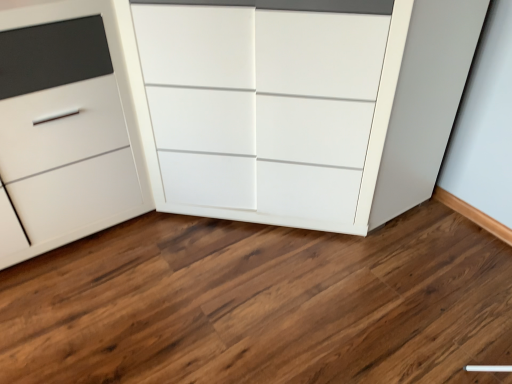
Question: Is white matte cabinet at lower left, arranged as the 1th chest of drawers when viewed from the left, to the left or to the right of white glossy cabinet at center, the first chest of drawers when ordered from right to left, in the image?

Choices:
 (A) left
 (B) right

Answer: (A)

Question: Relative to white glossy cabinet at center, the first chest of drawers when ordered from right to left, is white matte cabinet at lower left, arranged as the 1th chest of drawers when viewed from the left, in front or behind?

Choices:
 (A) front
 (B) behind

Answer: (B)

Question: Choose the correct answer: Is white matte cabinet at lower left, arranged as the 2th chest of drawers when viewed from the right, inside white glossy cabinet at center, the 2th chest of drawers viewed from the left, or outside it?

Choices:
 (A) outside
 (B) inside

Answer: (A)

Question: From a real-world perspective, relative to white matte cabinet at lower left, arranged as the 2th chest of drawers when viewed from the right, is white glossy cabinet at center, the first chest of drawers when ordered from right to left, vertically above or below?

Choices:
 (A) above
 (B) below

Answer: (A)

Question: From the image's perspective, is white glossy cabinet at center, the first chest of drawers when ordered from right to left, positioned above or below white matte cabinet at lower left, arranged as the 2th chest of drawers when viewed from the right?

Choices:
 (A) above
 (B) below

Answer: (A)

Question: Is white glossy cabinet at center, the 2th chest of drawers viewed from the left, bigger or smaller than white matte cabinet at lower left, arranged as the 1th chest of drawers when viewed from the left?

Choices:
 (A) big
 (B) small

Answer: (A)

Question: Considering the positions of white glossy cabinet at center, the 2th chest of drawers viewed from the left, and white matte cabinet at lower left, arranged as the 2th chest of drawers when viewed from the right, in the image, is white glossy cabinet at center, the 2th chest of drawers viewed from the left, taller or shorter than white matte cabinet at lower left, arranged as the 2th chest of drawers when viewed from the right,?

Choices:
 (A) short
 (B) tall

Answer: (B)